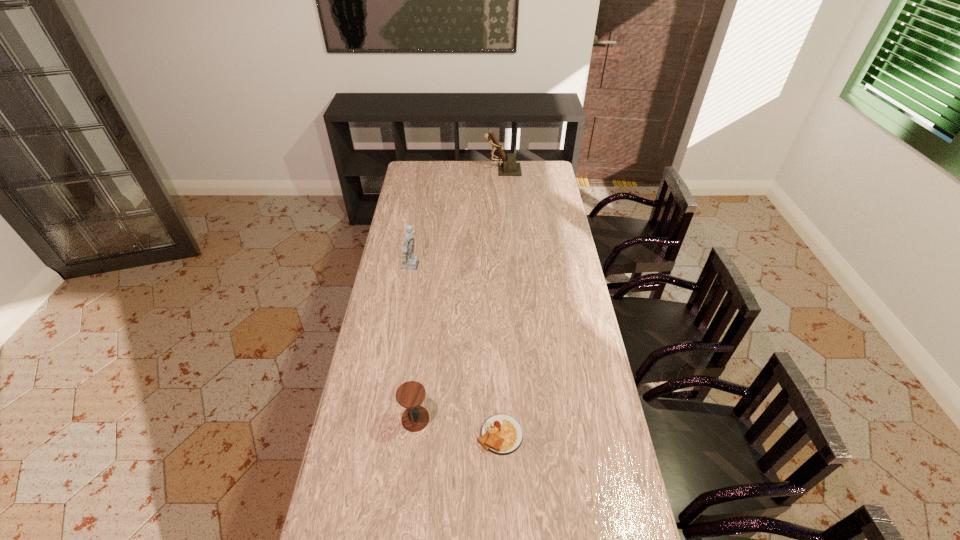
Identify the location of unoccupied area between the left figurine and the right figurine. (458, 218).

You are a GUI agent. You are given a task and a screenshot of the screen. Output one action in this format:
    pyautogui.click(x=<x>, y=<y>)
    Task: Click on the empty space between the second farthest object and the farthest object
    The width and height of the screenshot is (960, 540).
    Given the screenshot: What is the action you would take?
    pyautogui.click(x=458, y=218)

At what (x,y) coordinates should I click in order to perform the action: click on free spot between the third nearest object and the hourglass. Please return your answer as a coordinate pair (x, y). This screenshot has height=540, width=960. Looking at the image, I should click on (414, 343).

Find the location of a particular element. free point between the nearer figurine and the farther figurine is located at coordinates (458, 218).

You are a GUI agent. You are given a task and a screenshot of the screen. Output one action in this format:
    pyautogui.click(x=<x>, y=<y>)
    Task: Click on the blank region between the third tallest object and the farthest object
    
    Given the screenshot: What is the action you would take?
    pyautogui.click(x=459, y=294)

Where is `vacant area between the third nearest object and the shortest object`? vacant area between the third nearest object and the shortest object is located at coordinates (456, 350).

This screenshot has height=540, width=960. In order to click on free spot between the shortest object and the nearer figurine in this screenshot , I will do coord(456,350).

I want to click on free space between the right figurine and the shortest object, so click(x=501, y=302).

This screenshot has width=960, height=540. I want to click on vacant area that lies between the shortest object and the farthest object, so click(x=501, y=302).

Find the location of `object that is the closest to the shortest object`. object that is the closest to the shortest object is located at coordinates (411, 394).